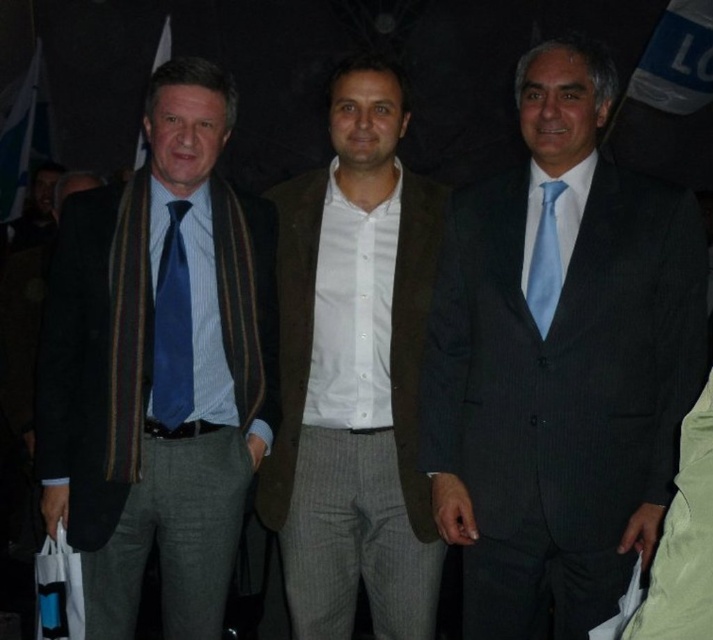
Based on the scene description, which object has a larger size between the matte black suit at center and the blue silk tie at left?

The matte black suit at center has a larger size compared to the blue silk tie at left.

You are a photographer at a formal event. You need to decide if the matte black suit at center can fit into a wardrobe space that is designed for the brown woolen blazer at center. Based on their widths, what would you advise?

The matte black suit at center is wider than the brown woolen blazer at center, so it may not fit into the wardrobe space designed for the brown woolen blazer at center.

You are a photographer adjusting your camera settings while focusing on the man in the center. You notice a point at coordinates (560, 365). What object is this point located on?

The point at coordinates (560, 365) is located on the matte black suit at center.